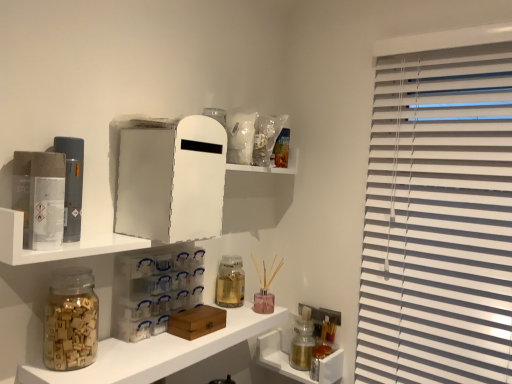
At what (x,y) coordinates should I click in order to perform the action: click on vacant space that is in between transparent plastic drawers at center, the first cabinet from the top, and transparent glass jar at lower left. Please return your answer as a coordinate pair (x, y). Looking at the image, I should click on (120, 343).